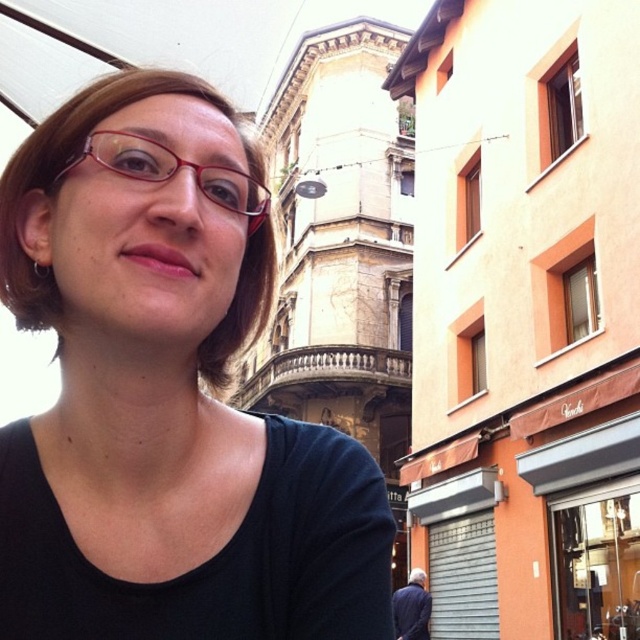
Question: Is matte red glasses at center to the left of dark blue fabric at lower right from the viewer's perspective?

Choices:
 (A) yes
 (B) no

Answer: (A)

Question: Which point appears farthest from the camera in this image?

Choices:
 (A) (x=122, y=436)
 (B) (x=412, y=609)

Answer: (B)

Question: Where is matte black shirt at center located in relation to matte red glasses at center in the image?

Choices:
 (A) below
 (B) above

Answer: (A)

Question: Which point appears farthest from the camera in this image?

Choices:
 (A) (52, 259)
 (B) (234, 176)
 (C) (419, 618)

Answer: (C)

Question: Which of the following is the farthest from the observer?

Choices:
 (A) dark blue fabric at lower right
 (B) matte black shirt at center

Answer: (A)

Question: Is matte black shirt at center smaller than matte red glasses at center?

Choices:
 (A) yes
 (B) no

Answer: (B)